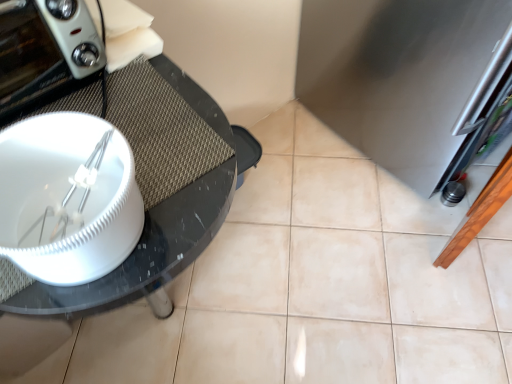
Question: Does matte white toaster at left have a greater width compared to stainless steel refrigerator at right?

Choices:
 (A) no
 (B) yes

Answer: (A)

Question: Does matte white toaster at left have a smaller size compared to stainless steel refrigerator at right?

Choices:
 (A) no
 (B) yes

Answer: (B)

Question: Does matte white toaster at left have a greater height compared to stainless steel refrigerator at right?

Choices:
 (A) yes
 (B) no

Answer: (B)

Question: Does matte white toaster at left lie behind stainless steel refrigerator at right?

Choices:
 (A) yes
 (B) no

Answer: (B)

Question: Does matte white toaster at left come in front of stainless steel refrigerator at right?

Choices:
 (A) no
 (B) yes

Answer: (B)

Question: Does matte white toaster at left have a lesser width compared to stainless steel refrigerator at right?

Choices:
 (A) no
 (B) yes

Answer: (B)

Question: Can you confirm if black glossy glass table at left is wider than stainless steel refrigerator at right?

Choices:
 (A) yes
 (B) no

Answer: (B)

Question: Can you confirm if black glossy glass table at left is bigger than stainless steel refrigerator at right?

Choices:
 (A) yes
 (B) no

Answer: (B)

Question: Does black glossy glass table at left have a lesser height compared to stainless steel refrigerator at right?

Choices:
 (A) no
 (B) yes

Answer: (B)

Question: From the image's perspective, is black glossy glass table at left located above stainless steel refrigerator at right?

Choices:
 (A) no
 (B) yes

Answer: (A)

Question: Is black glossy glass table at left oriented towards stainless steel refrigerator at right?

Choices:
 (A) no
 (B) yes

Answer: (A)

Question: Is black glossy glass table at left positioned beyond the bounds of stainless steel refrigerator at right?

Choices:
 (A) yes
 (B) no

Answer: (A)

Question: Considering the relative sizes of black glossy glass table at left and matte white toaster at left in the image provided, is black glossy glass table at left thinner than matte white toaster at left?

Choices:
 (A) yes
 (B) no

Answer: (B)